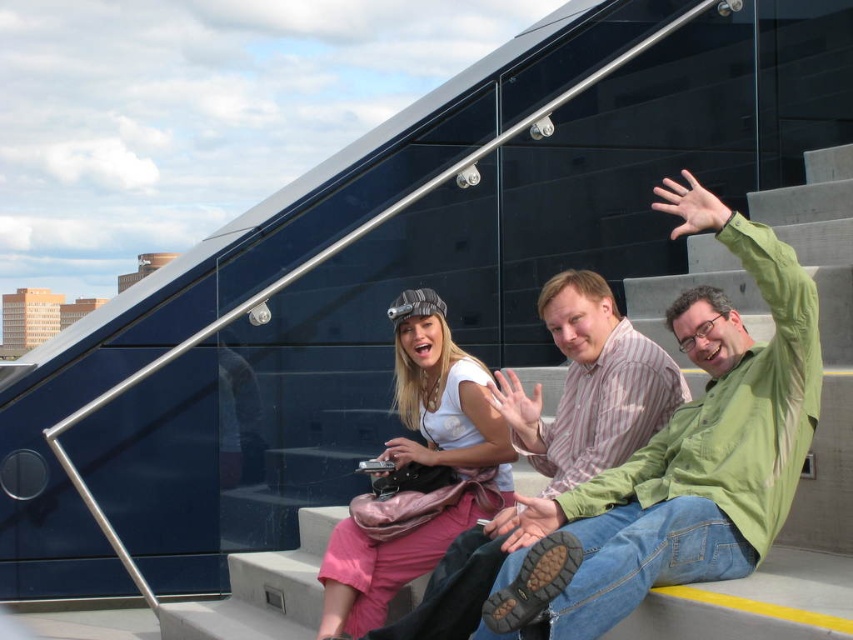
Is green cotton shirt at center taller than striped cotton shirt at center?

Yes, green cotton shirt at center is taller than striped cotton shirt at center.

Is green cotton shirt at center wider than striped cotton shirt at center?

No, green cotton shirt at center is not wider than striped cotton shirt at center.

Is point (529, 545) positioned in front of point (611, 348)?

That is True.

Identify the location of green cotton shirt at center. (682, 456).

Looking at this image, between white matte shirt at center and striped cotton shirt at center, which one has more height?

striped cotton shirt at center

Who is more distant from viewer, (424,564) or (675,380)?

→ Positioned behind is point (675,380).

Identify the location of white matte shirt at center. (418, 465).

Find the location of `white matte shirt at center`. white matte shirt at center is located at coordinates (418, 465).

Can you confirm if green cotton shirt at center is shorter than white matte shirt at center?

No, green cotton shirt at center is not shorter than white matte shirt at center.

Between point (599, 616) and point (403, 547), which one is positioned in front?

Point (599, 616) is more forward.

I want to click on green cotton shirt at center, so click(682, 456).